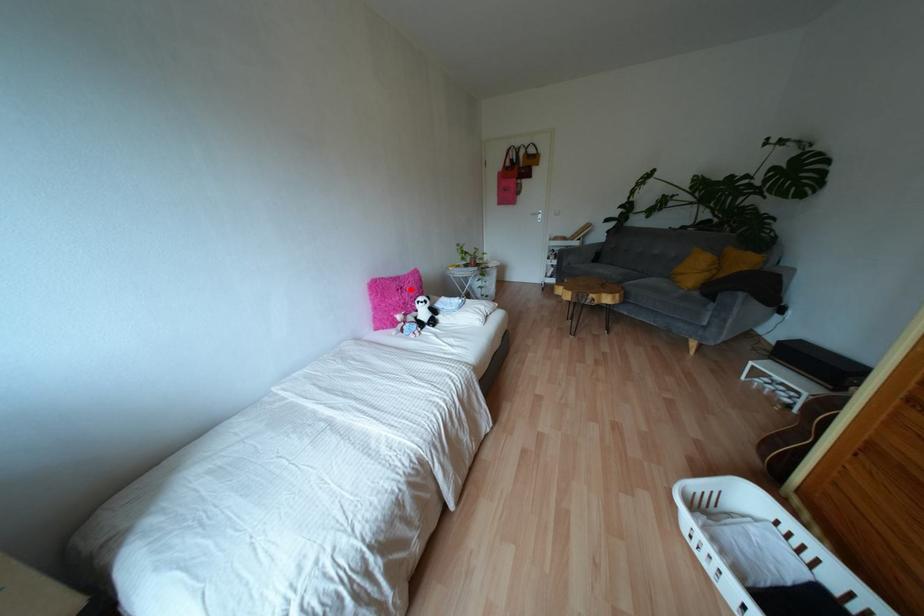
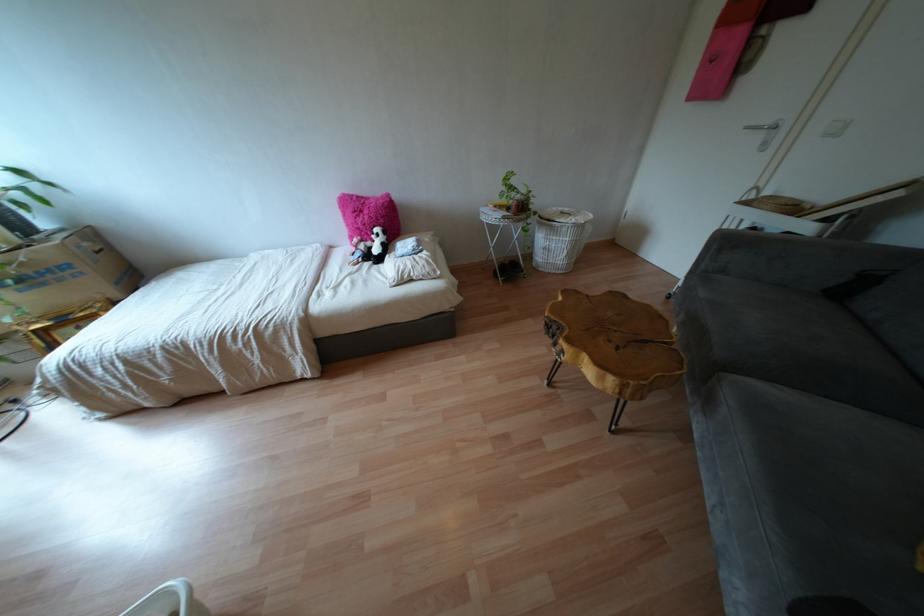
Question: I am providing you with two images of the same scene from different viewpoints. A red point is shown in image1. For the corresponding object point in image2, is it positioned nearer or farther from the camera?

Choices:
 (A) Nearer
 (B) Farther

Answer: (A)